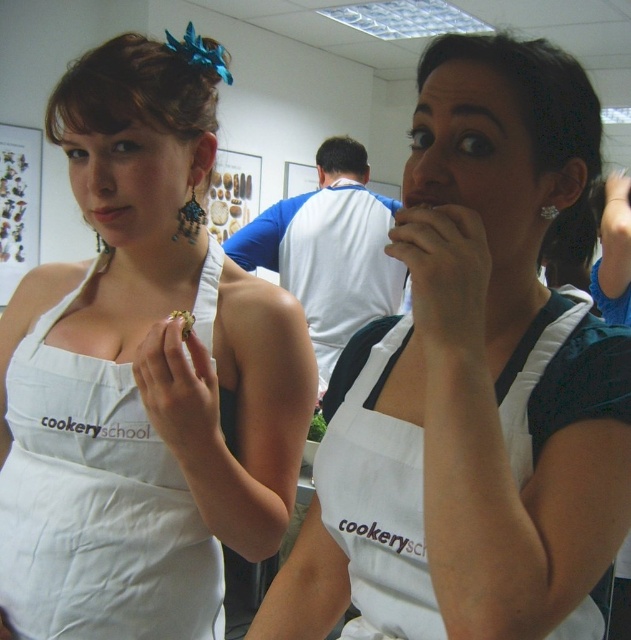
You are a chef in a cooking class and need to reach the gold metallic ring at upper center from the matte white apron at center. The chef has a 19.68 inch arm reach. Can you reach it?

The matte white apron at center is 21.29 inches away from gold metallic ring at upper center. Since the chef can only reach 19.68 inches, they cannot reach the gold metallic ring at upper center from the matte white apron at center.

You are a chef standing in front of the matte white apron at center. You need to reach an ingredient that is 30 inches away from you. Can you reach it while staying in your current position?

The matte white apron at center is 27.56 inches from the viewer. Since the ingredient is 30 inches away, it is 2.44 inches further away than the apron. Therefore, you cannot reach the ingredient while staying in your current position.